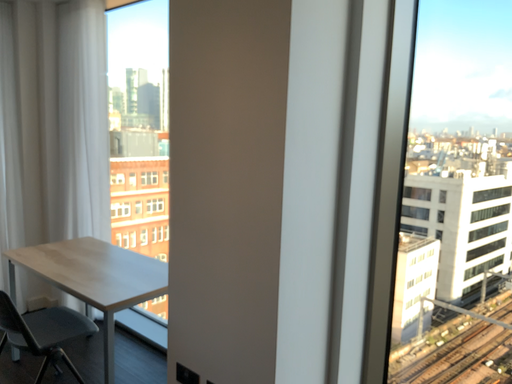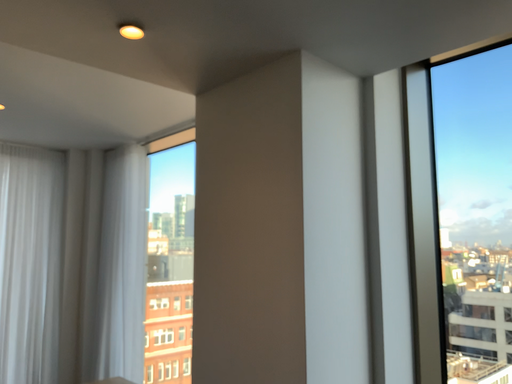
Question: Which way did the camera rotate in the video?

Choices:
 (A) rotated upward
 (B) rotated downward

Answer: (A)